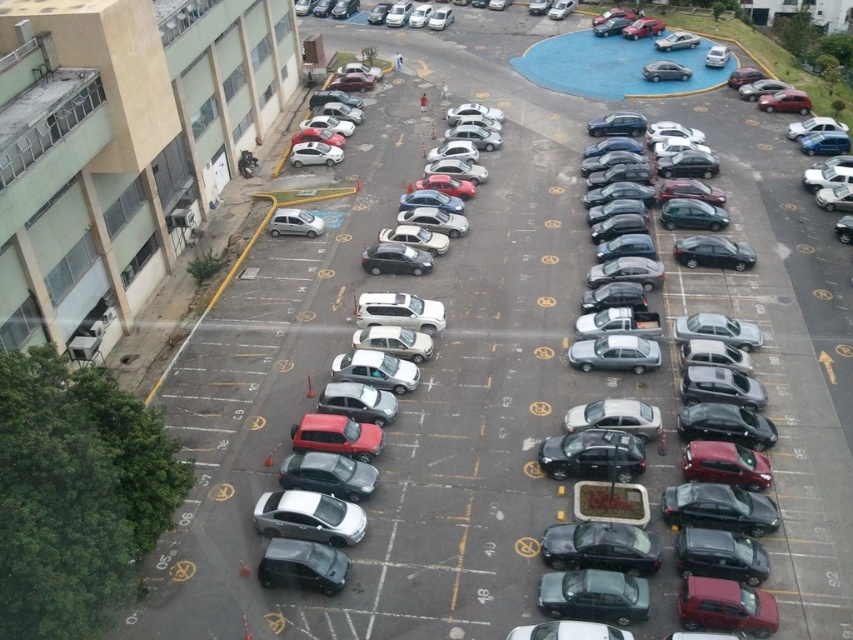
Question: Which point is closer to the camera taking this photo?

Choices:
 (A) (386, 563)
 (B) (294, 227)
 (C) (717, 51)

Answer: (A)

Question: Is satin silver sedan at upper center above silver metallic car at upper right?

Choices:
 (A) no
 (B) yes

Answer: (B)

Question: Estimate the real-world distances between objects in this image. Which object is closer to the satin silver sedan at upper center?

Choices:
 (A) silver metallic car at upper right
 (B) matte gray car at left

Answer: (A)

Question: Is satin silver sedan at center-left to the right of satin silver sedan at upper center from the viewer's perspective?

Choices:
 (A) yes
 (B) no

Answer: (B)

Question: Is metallic silver sedan at center further to the viewer compared to satin silver sedan at center?

Choices:
 (A) no
 (B) yes

Answer: (A)

Question: Which point is farther from the camera taking this photo?

Choices:
 (A) (332, 90)
 (B) (657, 60)
 (C) (553, 392)
 (D) (287, 234)

Answer: (B)